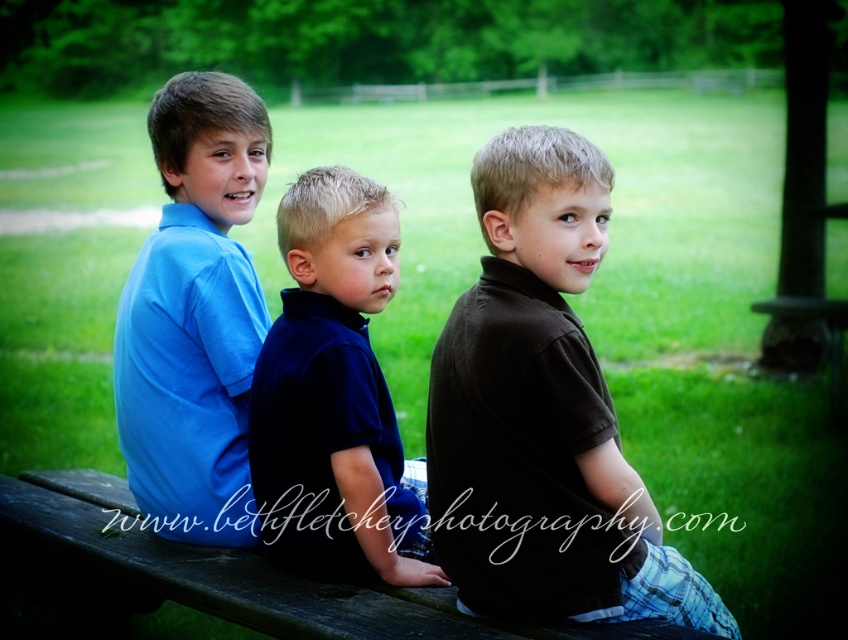
Who is positioned more to the right, matte blue shirt at center or dark blue velvety shirt at center?

dark blue velvety shirt at center

Is matte blue shirt at center to the left of dark blue velvety shirt at center from the viewer's perspective?

Yes, matte blue shirt at center is to the left of dark blue velvety shirt at center.

Between point (226, 184) and point (355, 460), which one is positioned in front?

Positioned in front is point (355, 460).

Locate an element on the screen. Image resolution: width=848 pixels, height=640 pixels. matte blue shirt at center is located at coordinates (194, 316).

Can you confirm if matte blue shirt at center is bigger than wooden park bench at center?

No.

Is point (144, 381) positioned in front of point (219, 554)?

No.

The height and width of the screenshot is (640, 848). I want to click on matte blue shirt at center, so click(194, 316).

Is dark blue velvety shirt at center positioned at the back of wooden park bench at center?

Yes.

Based on the photo, does dark blue velvety shirt at center appear on the left side of wooden park bench at center?

In fact, dark blue velvety shirt at center is to the right of wooden park bench at center.

Who is more forward, (360, 556) or (101, 563)?

Point (360, 556)

You are a GUI agent. You are given a task and a screenshot of the screen. Output one action in this format:
    pyautogui.click(x=<x>, y=<y>)
    Task: Click on the dark blue velvety shirt at center
    The width and height of the screenshot is (848, 640).
    Given the screenshot: What is the action you would take?
    pyautogui.click(x=333, y=396)